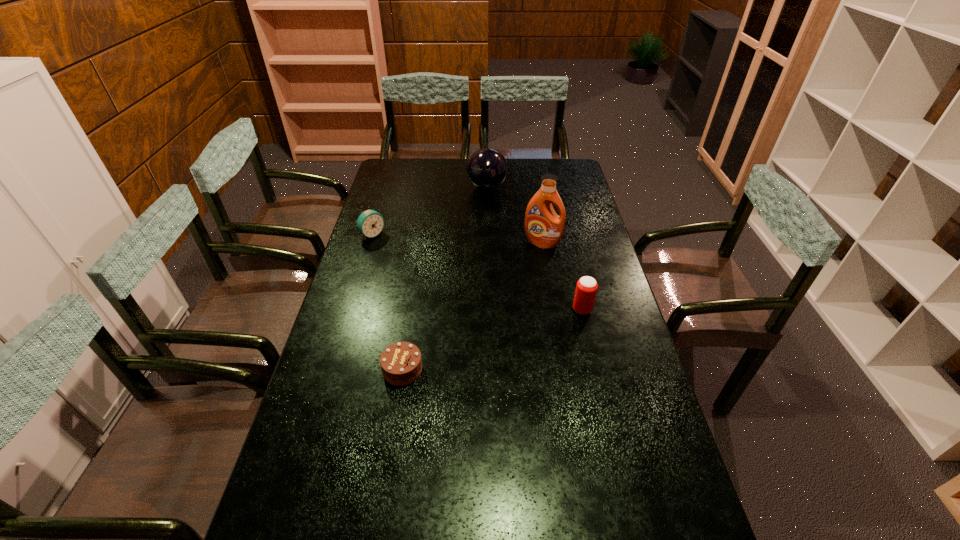
Where is `beer can at the right edge`? The height and width of the screenshot is (540, 960). beer can at the right edge is located at coordinates (586, 288).

The image size is (960, 540). Identify the location of detergent present at the right edge. (544, 228).

The height and width of the screenshot is (540, 960). Identify the location of free space at the far edge. tap(452, 160).

This screenshot has height=540, width=960. I want to click on vacant space at the near edge of the desktop, so click(x=342, y=527).

You are a GUI agent. You are given a task and a screenshot of the screen. Output one action in this format:
    pyautogui.click(x=<x>, y=<y>)
    Task: Click on the free space at the left edge of the desktop
    This screenshot has height=540, width=960.
    Given the screenshot: What is the action you would take?
    pyautogui.click(x=341, y=368)

This screenshot has height=540, width=960. What are the coordinates of `vacant area at the right edge` in the screenshot? It's located at (602, 248).

The width and height of the screenshot is (960, 540). Find the location of `blank space at the far right corner of the desktop`. blank space at the far right corner of the desktop is located at coordinates (555, 172).

Locate an element on the screen. blank space at the near right corner of the desktop is located at coordinates (684, 519).

Identify the location of empty space that is in between the leftmost object and the farthest object. The image size is (960, 540). (430, 211).

Locate an element on the screen. This screenshot has height=540, width=960. vacant area between the tallest object and the chocolate cake is located at coordinates (472, 306).